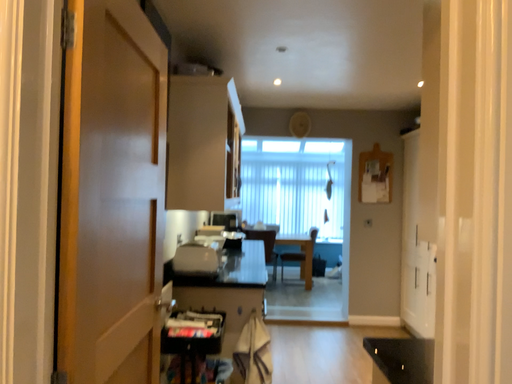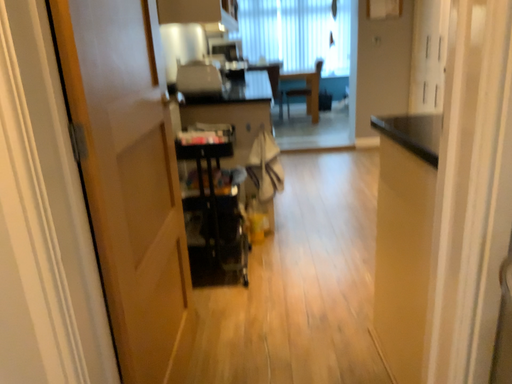
Question: How did the camera likely rotate when shooting the video?

Choices:
 (A) rotated downward
 (B) rotated upward

Answer: (A)